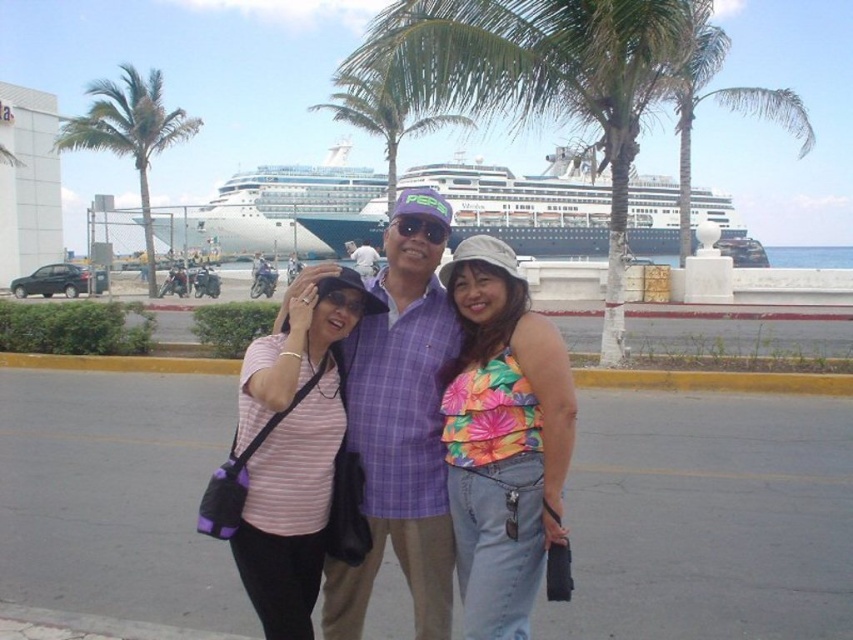
Question: Which point is farther to the camera?

Choices:
 (A) (264, 369)
 (B) (402, 525)

Answer: (B)

Question: Is the position of purple plaid shirt at center less distant than that of pink striped shirt at center?

Choices:
 (A) yes
 (B) no

Answer: (B)

Question: Can you confirm if striped cotton shirt at center is smaller than purple plaid shirt at center?

Choices:
 (A) yes
 (B) no

Answer: (B)

Question: Based on their relative distances, which object is farther from the floral fabric tank top at center?

Choices:
 (A) pink striped shirt at center
 (B) green leafy palm tree at upper left
 (C) striped cotton shirt at center

Answer: (B)

Question: Does striped cotton shirt at center appear under floral fabric tank top at center?

Choices:
 (A) yes
 (B) no

Answer: (B)

Question: Which point is farther to the camera?

Choices:
 (A) green leafy palm tree at upper left
 (B) purple plaid shirt at center

Answer: (A)